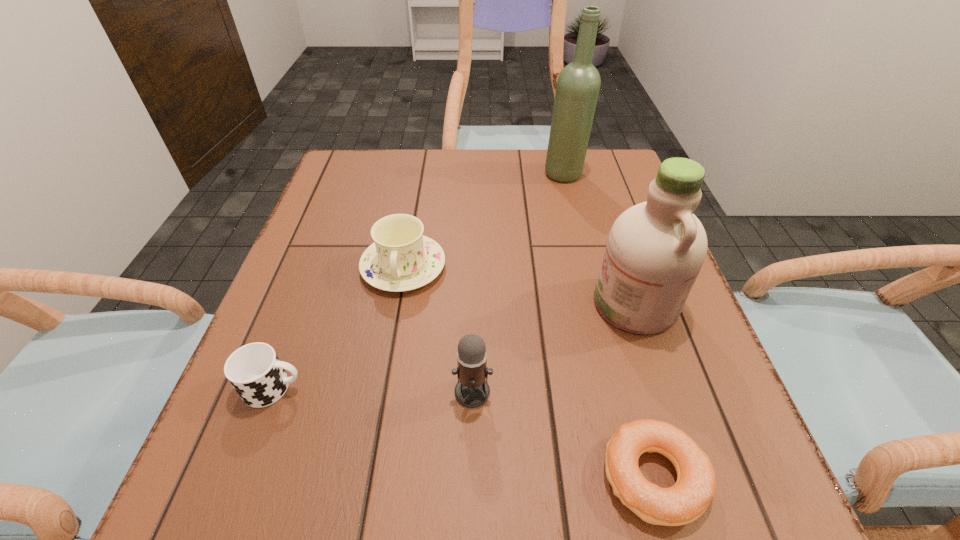
The height and width of the screenshot is (540, 960). Find the location of `bagel`. bagel is located at coordinates (687, 500).

Find the location of a particular element. This screenshot has width=960, height=540. blank area located 0.270m on the left of the tallest object is located at coordinates (442, 174).

What are the coordinates of `free location located on the front label of the second tallest object` in the screenshot? It's located at (415, 304).

The height and width of the screenshot is (540, 960). I want to click on vacant space located 0.050m on the front label of the second tallest object, so click(x=567, y=304).

The image size is (960, 540). I want to click on vacant point located 0.370m on the front label of the second tallest object, so click(x=399, y=304).

Where is `free region located on the left of the fourth object from right to left`? free region located on the left of the fourth object from right to left is located at coordinates (248, 392).

Find the location of a particular element. vacant space located 0.340m on the handle side of the third shortest object is located at coordinates (366, 480).

Locate an element on the screen. The image size is (960, 540). vacant space situated 0.220m on the side of the second shortest object with the handle is located at coordinates (441, 388).

Locate an element on the screen. This screenshot has height=540, width=960. free spot located 0.060m on the right of the shortest object is located at coordinates 748,476.

The image size is (960, 540). In order to click on object located in the far edge section of the desktop in this screenshot , I will do `click(578, 84)`.